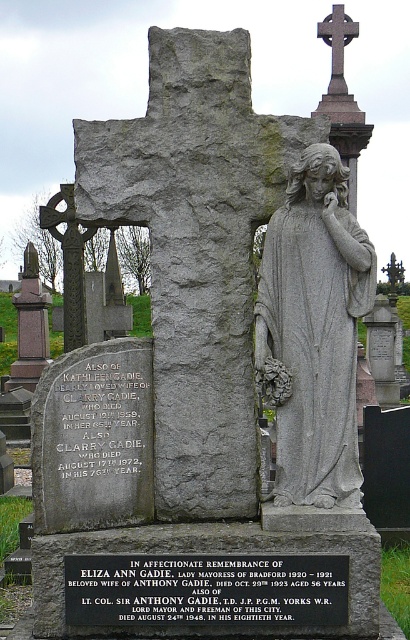
Does gray stone statue at center have a lesser width compared to black metal plaque at center?

Yes.

Is gray stone statue at center shorter than black metal plaque at center?

No, gray stone statue at center is not shorter than black metal plaque at center.

Where is `gray stone statue at center`? This screenshot has height=640, width=410. gray stone statue at center is located at coordinates (314, 332).

You are a GUI agent. You are given a task and a screenshot of the screen. Output one action in this format:
    pyautogui.click(x=<x>, y=<y>)
    Task: Click on the gray stone statue at center
    
    Given the screenshot: What is the action you would take?
    pyautogui.click(x=314, y=332)

Is gray stone statue at center wider than smooth stone cross at upper center?

Yes, gray stone statue at center is wider than smooth stone cross at upper center.

Between gray stone statue at center and smooth stone cross at upper center, which one is positioned lower?

gray stone statue at center is lower down.

Is point (289, 288) closer to viewer compared to point (336, 67)?

Yes, it is.

Locate an element on the screen. The image size is (410, 640). gray stone statue at center is located at coordinates (314, 332).

Can you confirm if black metal plaque at center is smaller than smooth stone cross at upper center?

Correct, black metal plaque at center occupies less space than smooth stone cross at upper center.

Identify the location of black metal plaque at center. (205, 589).